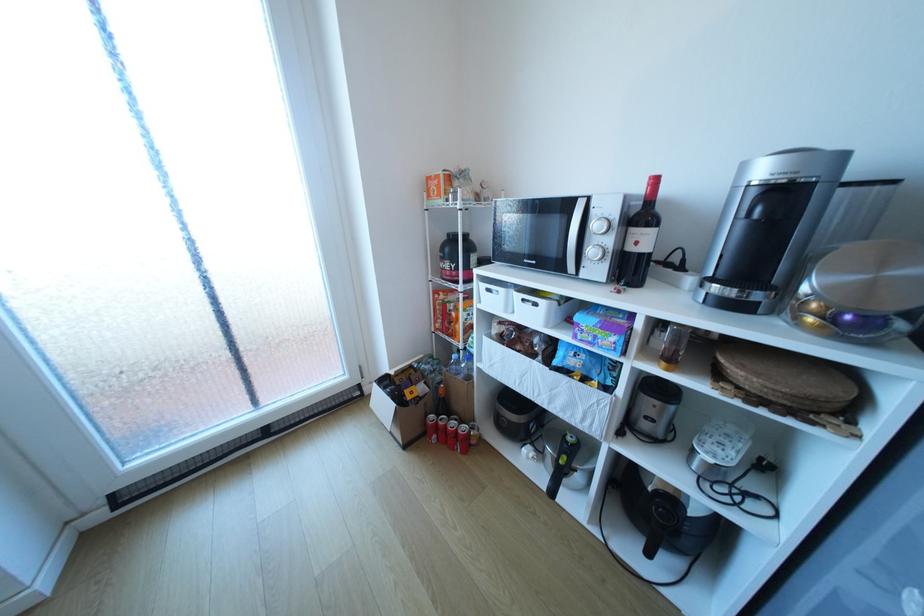
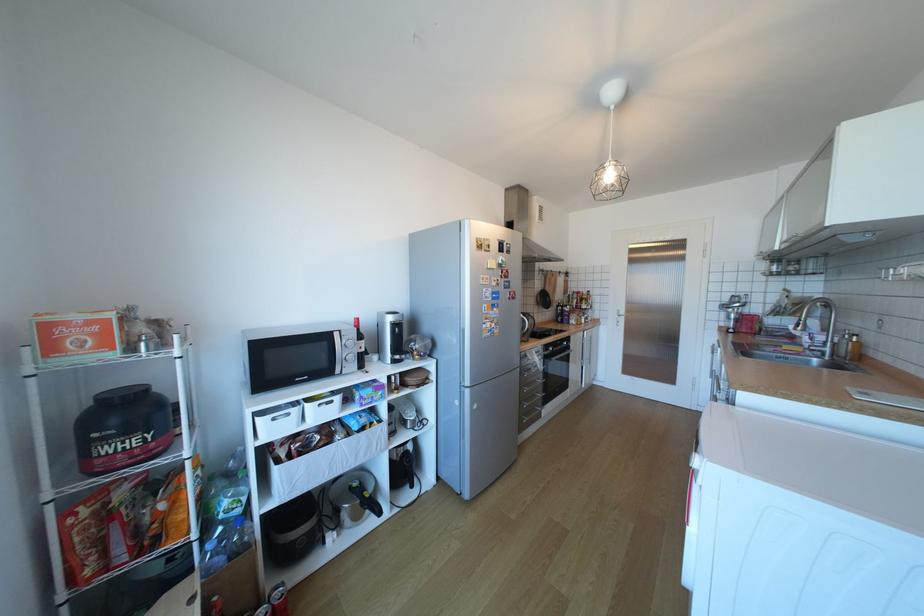
Find the pixel in the second image that matches (544,304) in the first image.

(341, 402)